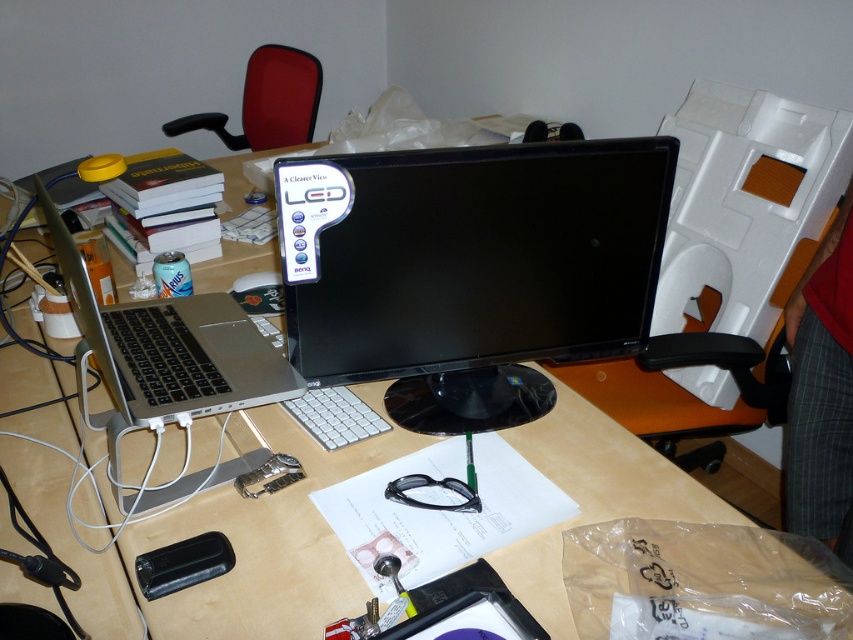
Question: Which point is closer to the camera?

Choices:
 (A) black glossy monitor at center
 (B) satin silver laptop at left

Answer: (B)

Question: Can you confirm if black glossy monitor at center is thinner than satin silver laptop at left?

Choices:
 (A) yes
 (B) no

Answer: (B)

Question: Does black glossy monitor at center have a greater width compared to satin silver laptop at left?

Choices:
 (A) yes
 (B) no

Answer: (A)

Question: Which point is farther to the camera?

Choices:
 (A) black glossy monitor at center
 (B) satin silver laptop at left

Answer: (A)

Question: Among these points, which one is farthest from the camera?

Choices:
 (A) (556, 346)
 (B) (166, 310)

Answer: (B)

Question: Observing the image, what is the correct spatial positioning of black glossy monitor at center in reference to satin silver laptop at left?

Choices:
 (A) above
 (B) below

Answer: (A)